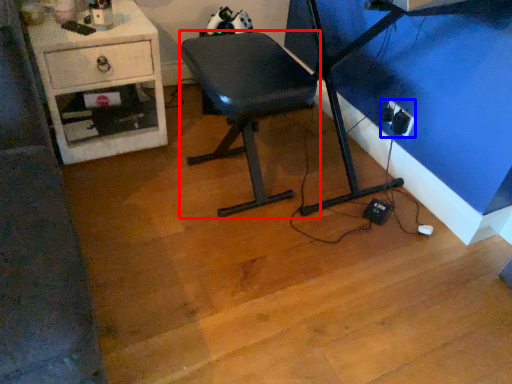
Question: Which object is further to the camera taking this photo, furniture (highlighted by a red box) or electric outlet (highlighted by a blue box)?

Choices:
 (A) furniture
 (B) electric outlet

Answer: (B)